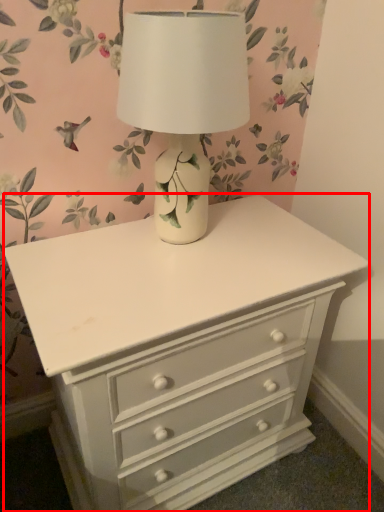
Question: From the image's perspective, where is chest of drawers (annotated by the red box) located relative to table lamp?

Choices:
 (A) above
 (B) below

Answer: (B)